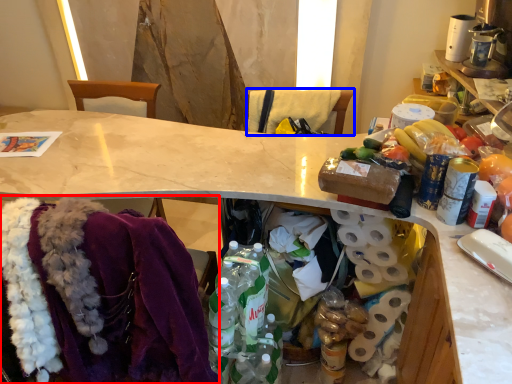
Question: Which point is further to the camera, clothing (highlighted by a red box) or leftover (highlighted by a blue box)?

Choices:
 (A) clothing
 (B) leftover

Answer: (B)